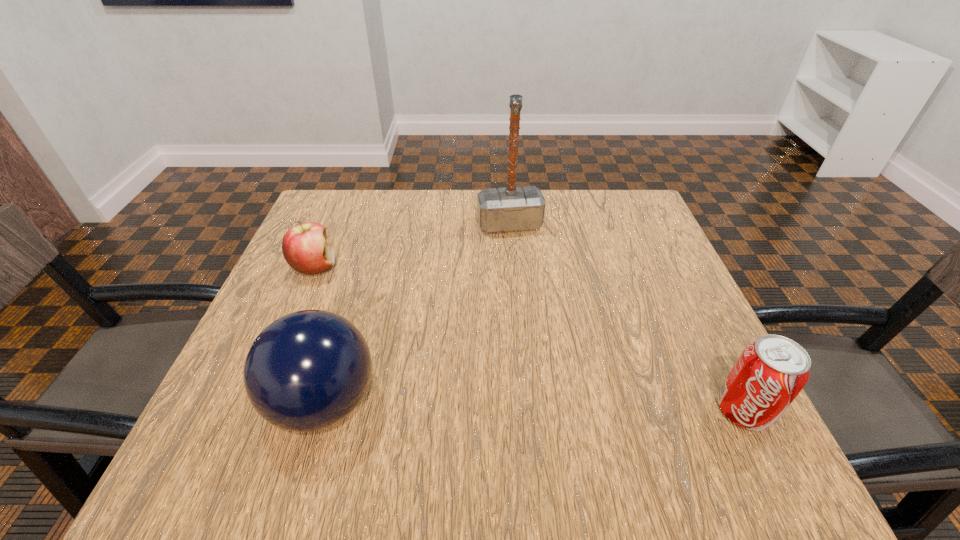
This screenshot has height=540, width=960. Identify the location of free region located 0.120m on the bitten side of the shortest object. (369, 297).

Find the location of a particular element. This screenshot has height=540, width=960. vacant point located 0.250m on the bitten side of the shortest object is located at coordinates (416, 322).

Locate an element on the screen. This screenshot has width=960, height=540. vacant space located on the striking surface of the farthest object is located at coordinates (541, 329).

Where is `free space located 0.210m on the striking surface of the farthest object`? Image resolution: width=960 pixels, height=540 pixels. free space located 0.210m on the striking surface of the farthest object is located at coordinates (532, 295).

Locate an element on the screen. vacant space situated 0.160m on the striking surface of the farthest object is located at coordinates (527, 279).

At what (x,y) coordinates should I click in order to perform the action: click on object situated at the far edge. Please return your answer as a coordinate pair (x, y). The height and width of the screenshot is (540, 960). Looking at the image, I should click on (512, 208).

Where is `bowling ball located at the near edge`? bowling ball located at the near edge is located at coordinates (308, 370).

I want to click on soda situated at the near edge, so [769, 374].

Where is `bowling ball at the left edge`? This screenshot has height=540, width=960. bowling ball at the left edge is located at coordinates (308, 370).

Locate an element on the screen. The width and height of the screenshot is (960, 540). apple that is positioned at the left edge is located at coordinates (305, 247).